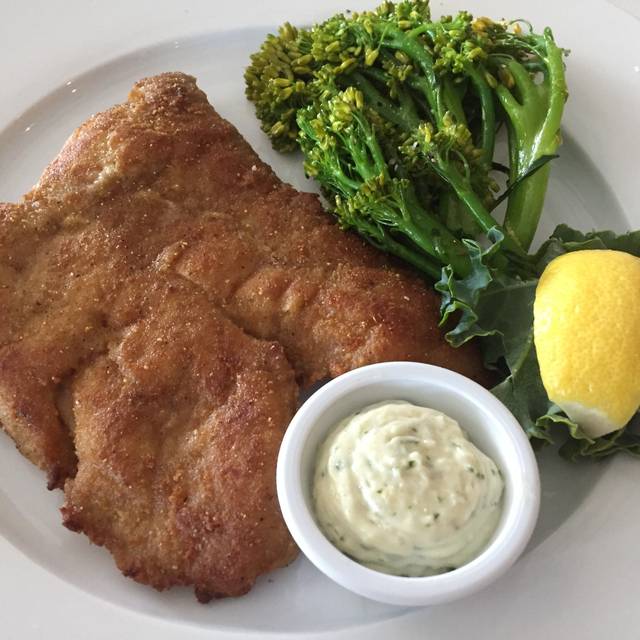
Where is `dinner plate`? This screenshot has width=640, height=640. dinner plate is located at coordinates (285, 607).